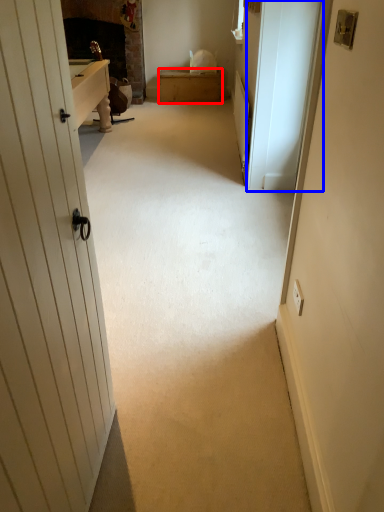
Question: Which object appears farthest to the camera in this image, furniture (highlighted by a red box) or screen door (highlighted by a blue box)?

Choices:
 (A) furniture
 (B) screen door

Answer: (A)